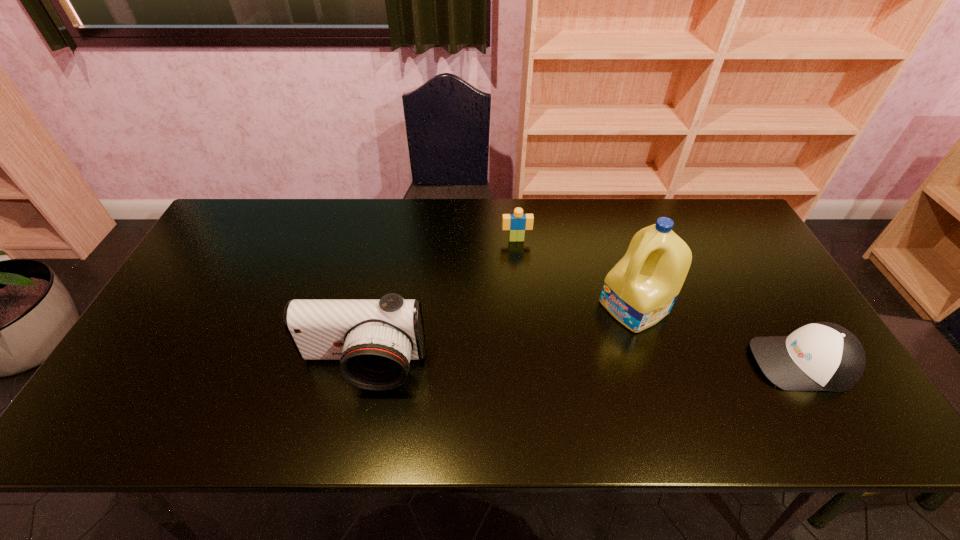
I want to click on free space located on the label of the detergent, so click(525, 371).

Locate an element on the screen. The width and height of the screenshot is (960, 540). free point located 0.170m on the label of the detergent is located at coordinates (561, 350).

The height and width of the screenshot is (540, 960). Find the location of `vacant space located on the label of the detergent`. vacant space located on the label of the detergent is located at coordinates (592, 332).

The width and height of the screenshot is (960, 540). I want to click on free space located on the face of the second object from left to right, so click(530, 346).

Identify the location of vacant region located 0.070m on the face of the second object from left to right. (518, 258).

Where is `vacant area located on the face of the second object from left to right`? vacant area located on the face of the second object from left to right is located at coordinates (526, 319).

Locate an element on the screen. object that is at the far edge is located at coordinates (517, 223).

Where is `camcorder positioned at the near edge`? camcorder positioned at the near edge is located at coordinates (374, 339).

At what (x,y) coordinates should I click in order to perform the action: click on cap situated at the near edge. Please return your answer as a coordinate pair (x, y). The image size is (960, 540). Looking at the image, I should click on (821, 356).

You are a GUI agent. You are given a task and a screenshot of the screen. Output one action in this format:
    pyautogui.click(x=<x>, y=<y>)
    Task: Click on the object situated at the right edge
    This screenshot has width=960, height=540.
    Given the screenshot: What is the action you would take?
    pyautogui.click(x=821, y=356)